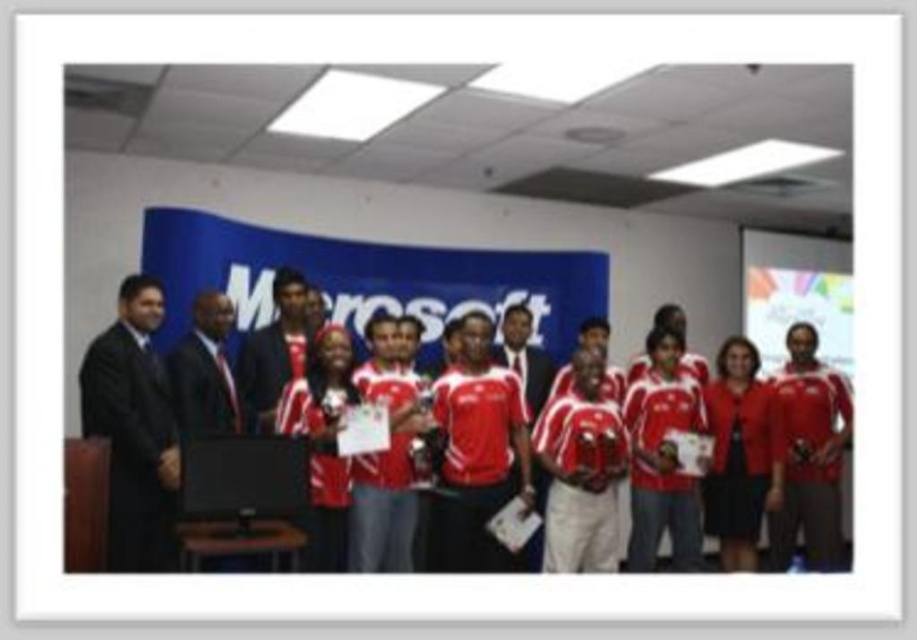
Question: Does matte red jersey at center have a smaller size compared to matte red shirt at center?

Choices:
 (A) yes
 (B) no

Answer: (B)

Question: From the image, what is the correct spatial relationship of matte red jersey at center in relation to black suit at left?

Choices:
 (A) above
 (B) below

Answer: (A)

Question: Is the position of matte red jersey at center more distant than that of black suit at left?

Choices:
 (A) yes
 (B) no

Answer: (A)

Question: Which point appears closest to the camera in this image?

Choices:
 (A) (775, 381)
 (B) (193, 394)

Answer: (B)

Question: Which object is closer to the camera taking this photo?

Choices:
 (A) matte red jersey at center
 (B) matte red shirt at center

Answer: (A)

Question: Considering the real-world distances, which object is closest to the matte red shirt at center?

Choices:
 (A) black suit at left
 (B) matte red jersey at center

Answer: (B)